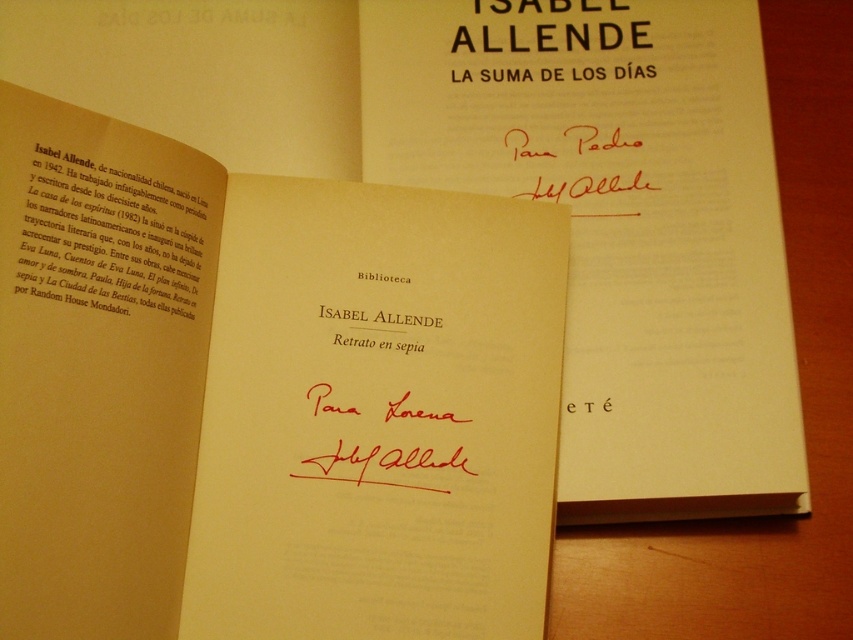
Question: Is sepia paper book at center positioned before sepia paper text at upper left?

Choices:
 (A) no
 (B) yes

Answer: (B)

Question: Considering the relative positions of sepia paper book at center and sepia paper text at upper left in the image provided, where is sepia paper book at center located with respect to sepia paper text at upper left?

Choices:
 (A) right
 (B) left

Answer: (A)

Question: Which object is farther from the camera taking this photo?

Choices:
 (A) sepia paper text at upper left
 (B) sepia paper book at center

Answer: (A)

Question: Is sepia paper book at center positioned in front of sepia paper text at upper left?

Choices:
 (A) no
 (B) yes

Answer: (B)